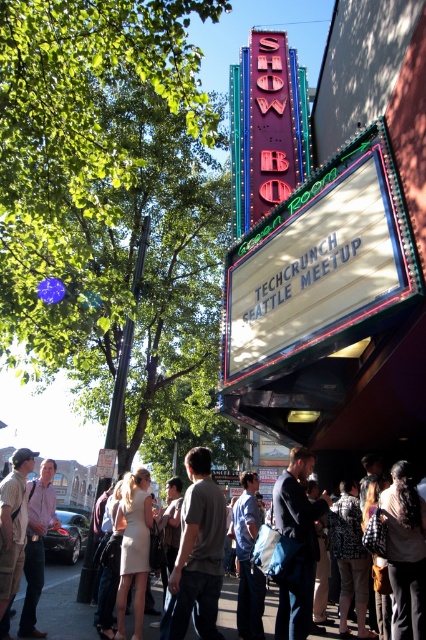
Can you confirm if dark blue shirt at center is positioned above light brown fabric crowd at lower center?

Yes, dark blue shirt at center is above light brown fabric crowd at lower center.

Locate an element on the screen. dark blue shirt at center is located at coordinates (299, 541).

At what (x,y) coordinates should I click in order to perform the action: click on dark blue shirt at center. Please return your answer as a coordinate pair (x, y). This screenshot has height=640, width=426. Looking at the image, I should click on tap(299, 541).

Find the location of `dark blue shirt at center`. dark blue shirt at center is located at coordinates (299, 541).

How far apart are gray cotton t-shirt at center and light brown leather jacket at lower left?

A distance of 3.95 meters exists between gray cotton t-shirt at center and light brown leather jacket at lower left.

Does point (189, 602) lie in front of point (52, 516)?

Yes.

Is point (195, 563) closer to viewer compared to point (46, 470)?

Yes, it is.

The height and width of the screenshot is (640, 426). What are the coordinates of `gray cotton t-shirt at center` in the screenshot? It's located at tap(196, 554).

Can you confirm if light brown fabric crowd at lower center is positioned below light brown leather jacket at lower left?

Yes, light brown fabric crowd at lower center is below light brown leather jacket at lower left.

Between light brown fabric crowd at lower center and light brown leather jacket at lower left, which one appears on the left side from the viewer's perspective?

Positioned to the left is light brown leather jacket at lower left.

Is point (63, 572) positioned in front of point (36, 582)?

No, it is behind (36, 582).

This screenshot has width=426, height=640. Find the location of `light brown fabric crowd at lower center`. light brown fabric crowd at lower center is located at coordinates (63, 605).